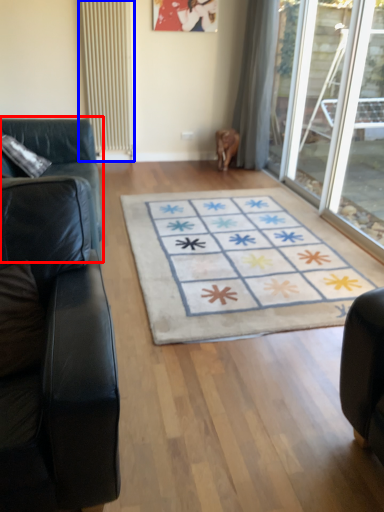
Question: Among these objects, which one is farthest to the camera, studio couch (highlighted by a red box) or radiator (highlighted by a blue box)?

Choices:
 (A) studio couch
 (B) radiator

Answer: (B)